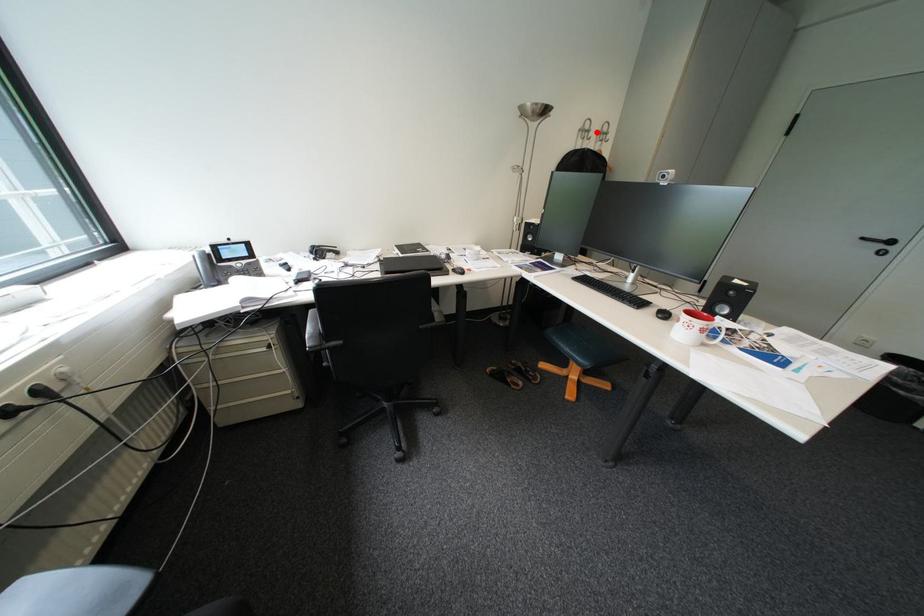
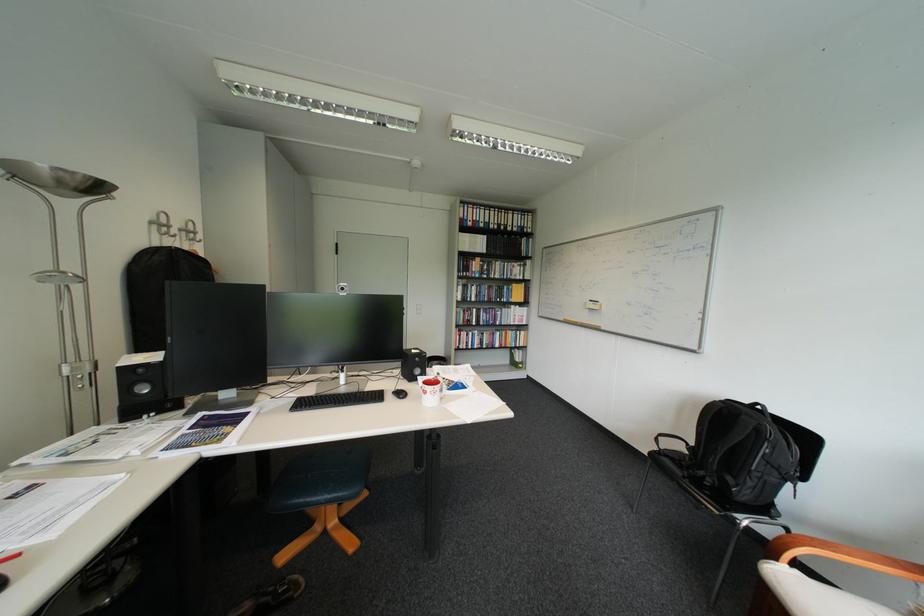
Locate, in the second image, the point that corresponds to the highlighted location in the first image.

(173, 225)